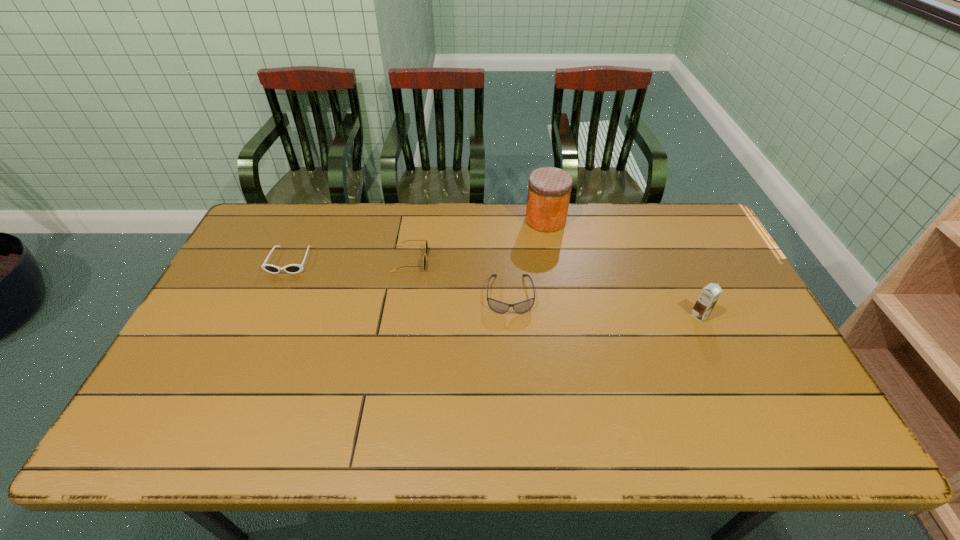
Find the location of a particular element. Image resolution: width=960 pixels, height=540 pixels. free space between the rightmost object and the jar is located at coordinates (622, 268).

Select which object appears as the third closest to the nearest sunglasses. Please provide its 2D coordinates. Your answer should be formatted as a tuple, i.e. [(x, y)], where the tuple contains the x and y coordinates of a point satisfying the conditions above.

[(709, 295)]

Locate which object ranks second in proximity to the leftmost sunglasses. Please provide its 2D coordinates. Your answer should be formatted as a tuple, i.e. [(x, y)], where the tuple contains the x and y coordinates of a point satisfying the conditions above.

[(497, 306)]

Choose which sunglasses is the second nearest neighbor to the second object from left to right. Please provide its 2D coordinates. Your answer should be formatted as a tuple, i.e. [(x, y)], where the tuple contains the x and y coordinates of a point satisfying the conditions above.

[(292, 268)]

Locate an element on the screen. sunglasses that stands as the closest to the rightmost sunglasses is located at coordinates (426, 244).

Find the location of a particular element. vacant region that satisfies the following two spatial constraints: 1. on the lenses of the nearest sunglasses; 2. on the left side of the chocolate milk is located at coordinates (511, 316).

The image size is (960, 540). In order to click on vacant space that satisfies the following two spatial constraints: 1. with the lenses of the leftmost object facing outward; 2. on the left side of the rightmost object in this screenshot , I will do `click(266, 316)`.

Locate an element on the screen. Image resolution: width=960 pixels, height=540 pixels. free space that satisfies the following two spatial constraints: 1. on the lenses of the rightmost sunglasses; 2. on the left side of the fourth shortest object is located at coordinates (511, 316).